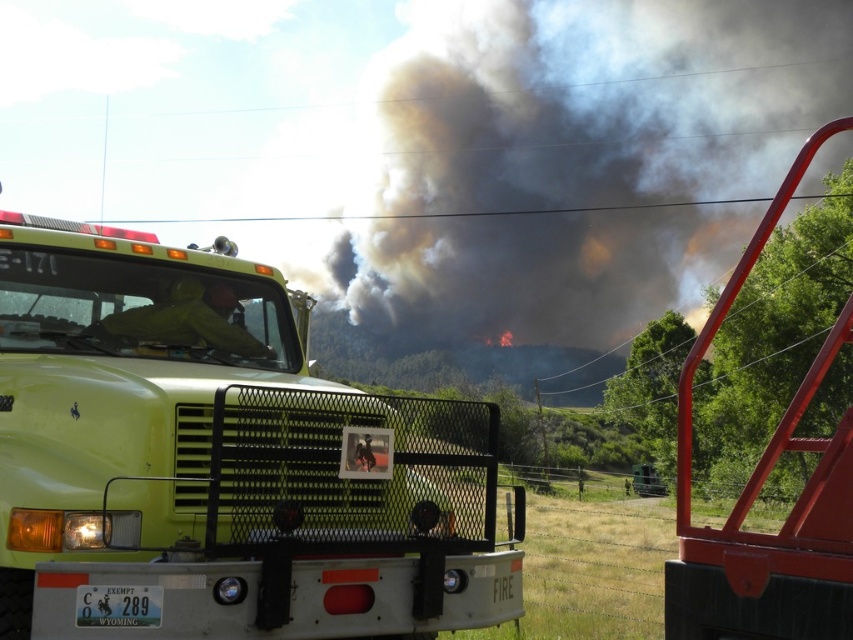
Between green matte fire truck at center and dark gray smoke at upper center, which one is positioned lower?

green matte fire truck at center

Does point (285, 368) come behind point (520, 296)?

No, (285, 368) is in front of (520, 296).

Locate an element on the screen. This screenshot has width=853, height=640. green matte fire truck at center is located at coordinates (219, 460).